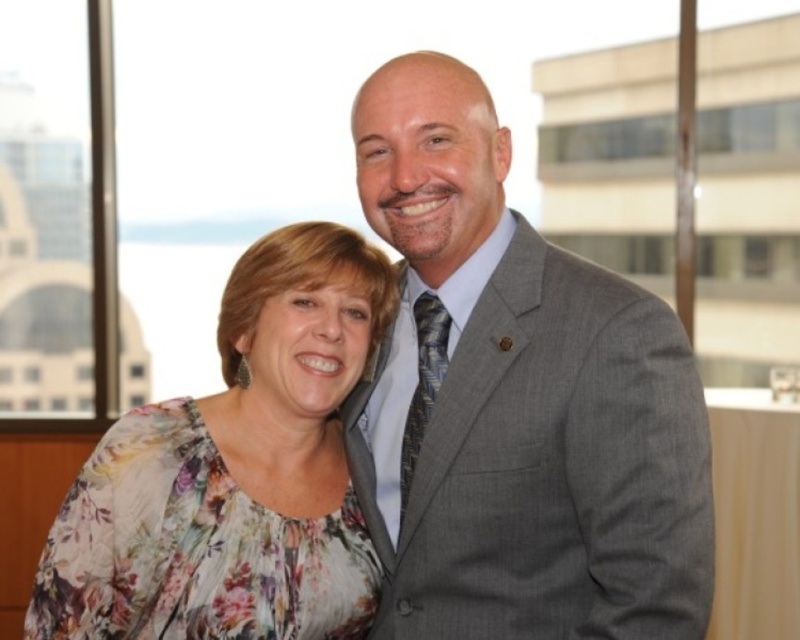
Between point (474, 260) and point (70, 636), which one is positioned behind?

Positioned behind is point (474, 260).

Is gray textured suit at center below floral fabric blouse at center?

Incorrect, gray textured suit at center is not positioned below floral fabric blouse at center.

What do you see at coordinates (516, 401) in the screenshot?
I see `gray textured suit at center` at bounding box center [516, 401].

At what (x,y) coordinates should I click in order to perform the action: click on gray textured suit at center. Please return your answer as a coordinate pair (x, y). Looking at the image, I should click on (516, 401).